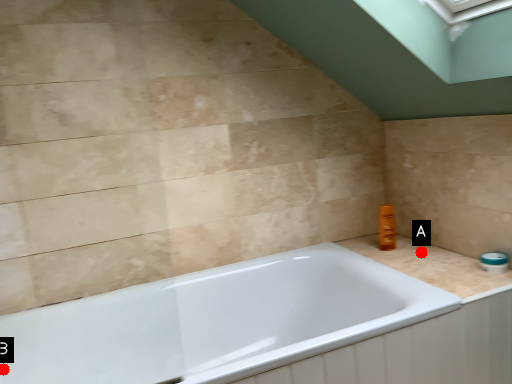
Question: Two points are circled on the image, labeled by A and B beside each circle. Among these points, which one is nearest to the camera?

Choices:
 (A) A is closer
 (B) B is closer

Answer: (B)